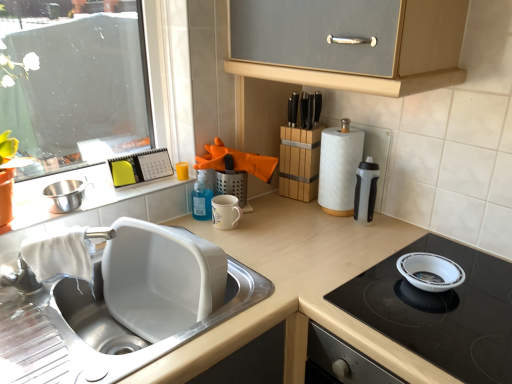
Locate an element on the screen. free space above matte white countertop at center (from a real-world perspective) is located at coordinates (312, 278).